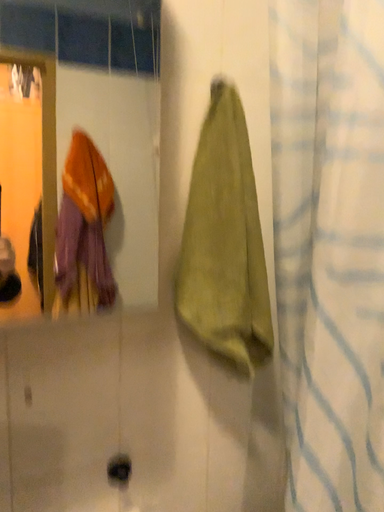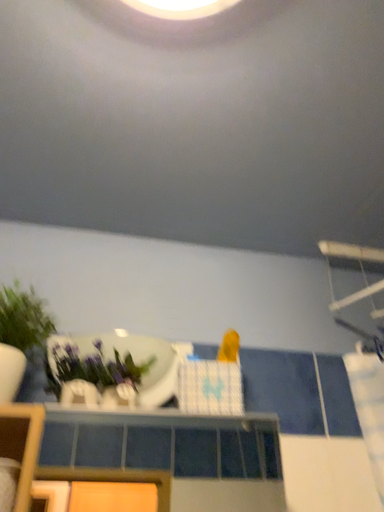
Question: Which way did the camera rotate in the video?

Choices:
 (A) rotated right
 (B) rotated left

Answer: (B)